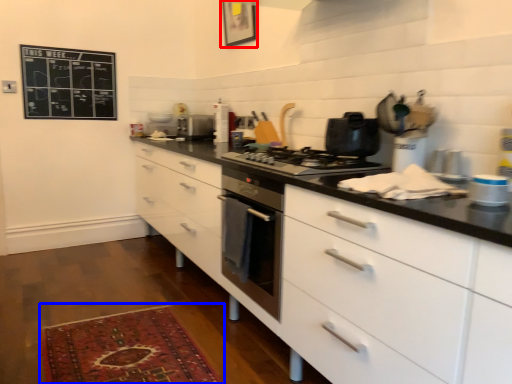
Question: Among these objects, which one is nearest to the camera, picture frame (highlighted by a red box) or mat (highlighted by a blue box)?

Choices:
 (A) picture frame
 (B) mat

Answer: (B)